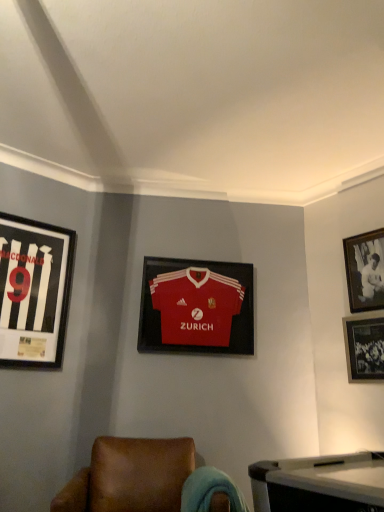
Question: From a real-world perspective, is black glossy photo frame at upper right, placed as the first picture frame when sorted from right to left, beneath black matte jersey at left, arranged as the 1th picture frame when viewed from the left?

Choices:
 (A) no
 (B) yes

Answer: (A)

Question: Is the position of black glossy photo frame at upper right, the 4th picture frame from the left, less distant than that of black matte jersey at left, arranged as the 1th picture frame when viewed from the left?

Choices:
 (A) no
 (B) yes

Answer: (A)

Question: From the image's perspective, is black glossy photo frame at upper right, placed as the first picture frame when sorted from right to left, located beneath black matte jersey at left, arranged as the 1th picture frame when viewed from the left?

Choices:
 (A) yes
 (B) no

Answer: (B)

Question: From the image's perspective, is black glossy photo frame at upper right, placed as the first picture frame when sorted from right to left, on black matte jersey at left, arranged as the 1th picture frame when viewed from the left?

Choices:
 (A) yes
 (B) no

Answer: (A)

Question: Does black glossy photo frame at upper right, placed as the first picture frame when sorted from right to left, have a lesser width compared to black matte jersey at left, arranged as the 1th picture frame when viewed from the left?

Choices:
 (A) yes
 (B) no

Answer: (A)

Question: Would you say black glossy photo frame at upper right, the 4th picture frame from the left, is a long distance from black matte jersey at left, acting as the fourth picture frame starting from the right?

Choices:
 (A) yes
 (B) no

Answer: (A)

Question: Does brown leather chair at lower center have a lesser height compared to black glossy photo frame at lower right, the 2th picture frame in the right-to-left sequence?

Choices:
 (A) no
 (B) yes

Answer: (A)

Question: Is the surface of brown leather chair at lower center in direct contact with black glossy photo frame at lower right, which appears as the 3th picture frame when viewed from the left?

Choices:
 (A) yes
 (B) no

Answer: (B)

Question: Does brown leather chair at lower center have a greater width compared to black glossy photo frame at lower right, the 2th picture frame in the right-to-left sequence?

Choices:
 (A) yes
 (B) no

Answer: (A)

Question: Is brown leather chair at lower center not near black glossy photo frame at lower right, the 2th picture frame in the right-to-left sequence?

Choices:
 (A) yes
 (B) no

Answer: (A)

Question: Is brown leather chair at lower center positioned with its back to black glossy photo frame at lower right, which appears as the 3th picture frame when viewed from the left?

Choices:
 (A) no
 (B) yes

Answer: (A)

Question: Can you confirm if brown leather chair at lower center is thinner than black glossy photo frame at lower right, which appears as the 3th picture frame when viewed from the left?

Choices:
 (A) no
 (B) yes

Answer: (A)

Question: Is brown leather chair at lower center positioned behind black glossy photo frame at upper right, the 4th picture frame from the left?

Choices:
 (A) no
 (B) yes

Answer: (A)